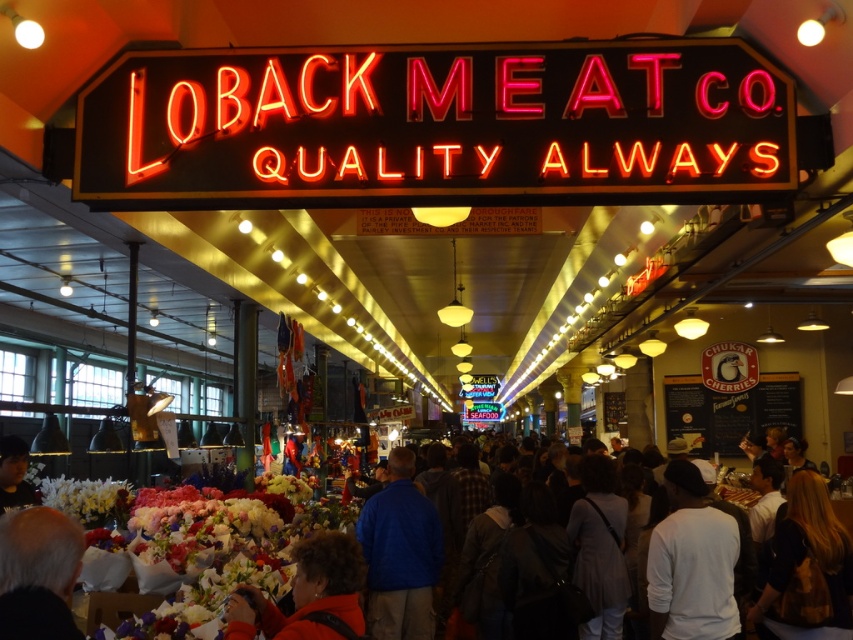
You are standing at the entrance of the market and see the point labeled as point (819, 556). What is the color of the clothing at that point?

The dark gray clothing at center is represented by point (819, 556), so the clothing at that point is dark gray.

You are a photographer aiming to capture a candid shot of the dark gray clothing at center and dark brown hair at center in the LOBACK MEATCO market scene. Considering their widths, which subject should you frame first to ensure both fit in the shot?

The dark gray clothing at center is wider than the dark brown hair at center. To ensure both fit in the shot, you should frame the wider dark gray clothing at center first, then adjust the composition to include the narrower dark brown hair at center.

You are a delivery person carrying a package that requires a 3 meter clearance to pass through the market. You notice the dark gray clothing at center and the blue fabric jacket at center. Will there be enough space between them to move your package through?

The dark gray clothing at center and blue fabric jacket at center are 2.69 meters apart from each other, which is less than the required 3 meters clearance. Therefore, there is not enough space to move the package through between them.